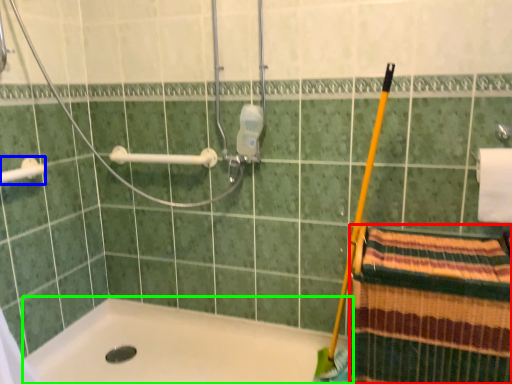
Question: Which object is the farthest from beach towel (highlighted by a red box)? Choose among these: towel bar (highlighted by a blue box) or bathtub (highlighted by a green box).

Choices:
 (A) towel bar
 (B) bathtub

Answer: (A)